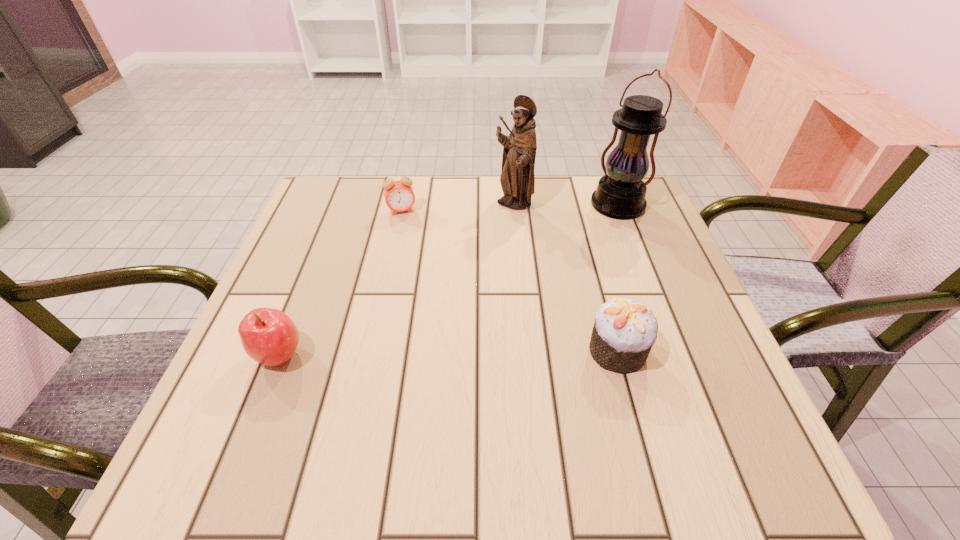
At what (x,y) coordinates should I click in order to perform the action: click on the leftmost object. Please return your answer as a coordinate pair (x, y). Image resolution: width=960 pixels, height=540 pixels. Looking at the image, I should click on (268, 336).

Image resolution: width=960 pixels, height=540 pixels. What are the coordinates of `cupcake` in the screenshot? It's located at 624,331.

At what (x,y) coordinates should I click in order to perform the action: click on lantern. Please return your answer as a coordinate pair (x, y). The height and width of the screenshot is (540, 960). Looking at the image, I should click on pyautogui.click(x=620, y=194).

This screenshot has width=960, height=540. I want to click on the second object from left to right, so click(x=399, y=196).

You are a GUI agent. You are given a task and a screenshot of the screen. Output one action in this format:
    pyautogui.click(x=<x>, y=<y>)
    Task: Click on the figurine
    
    Given the screenshot: What is the action you would take?
    pyautogui.click(x=517, y=179)

This screenshot has height=540, width=960. What are the coordinates of `the fourth shortest object` in the screenshot? It's located at (517, 179).

Identify the location of vacant point located on the back of the leftmost object. (324, 246).

Where is `vacant space positioned 0.210m on the left of the cupcake`? vacant space positioned 0.210m on the left of the cupcake is located at coordinates tap(475, 350).

Locate several points within the vacant space situated 0.370m above the lantern, indicating its light source. Please provide its 2D coordinates. Your answer should be formatted as a tuple, i.e. [(x, y)], where the tuple contains the x and y coordinates of a point satisfying the conditions above.

[(524, 301)]

Locate some placea in vacant space located above the lantern, indicating its light source. Please provide its 2D coordinates. Your answer should be formatted as a tuple, i.e. [(x, y)], where the tuple contains the x and y coordinates of a point satisfying the conditions above.

[(521, 304)]